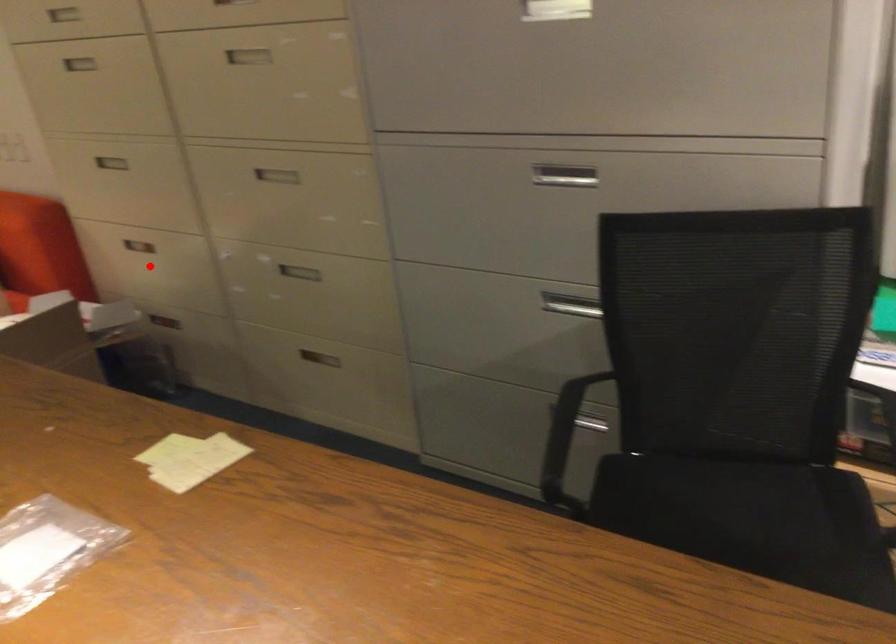
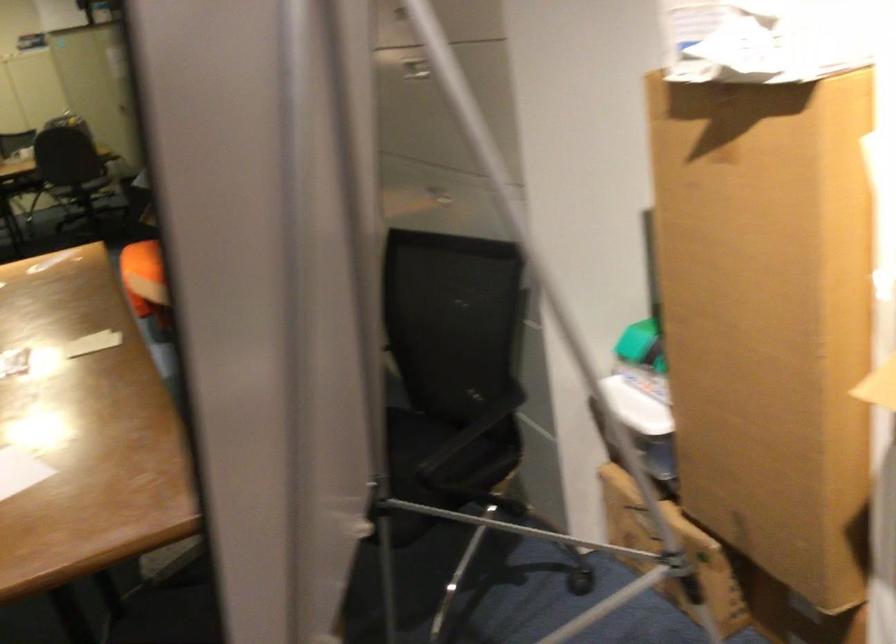
Question: I am providing you with two images of the same scene from different viewpoints. A red point is marked on the first image. Is the red point's position out of view in image 2?

Choices:
 (A) Yes
 (B) No

Answer: (A)